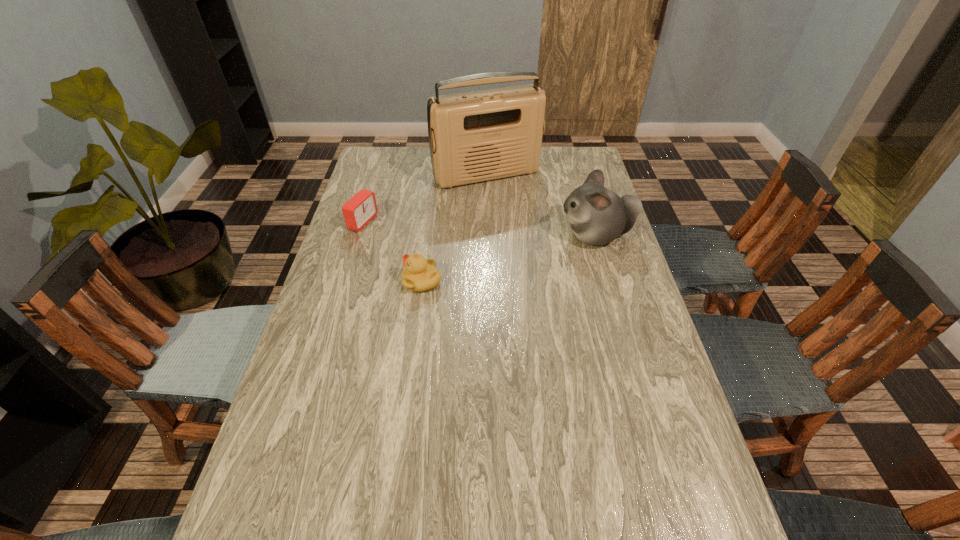
The height and width of the screenshot is (540, 960). I want to click on duckling, so click(x=420, y=274).

At what (x,y) coordinates should I click in order to perform the action: click on hamster. Please return your answer as a coordinate pair (x, y). Looking at the image, I should click on (597, 215).

At what (x,y) coordinates should I click in order to perform the action: click on the second tallest object. Please return your answer as a coordinate pair (x, y). This screenshot has height=540, width=960. Looking at the image, I should click on (597, 215).

You are a GUI agent. You are given a task and a screenshot of the screen. Output one action in this format:
    pyautogui.click(x=<x>, y=<y>)
    Task: Click on the leftmost object
    
    Given the screenshot: What is the action you would take?
    pyautogui.click(x=361, y=208)

Identify the location of the farthest object. Image resolution: width=960 pixels, height=540 pixels. (475, 136).

You are a GUI agent. You are given a task and a screenshot of the screen. Output one action in this format:
    pyautogui.click(x=<x>, y=<y>)
    Task: Click on the radio receiver
    
    Given the screenshot: What is the action you would take?
    pyautogui.click(x=475, y=136)

Identify the location of free point located on the beak of the nearest object. (385, 281).

Locate an element on the screen. blank space located on the beak of the nearest object is located at coordinates (350, 281).

The height and width of the screenshot is (540, 960). Identify the location of vacant space located on the beak of the nearest object. (361, 281).

This screenshot has width=960, height=540. I want to click on free space located 0.290m on the face of the hamster, so click(x=469, y=235).